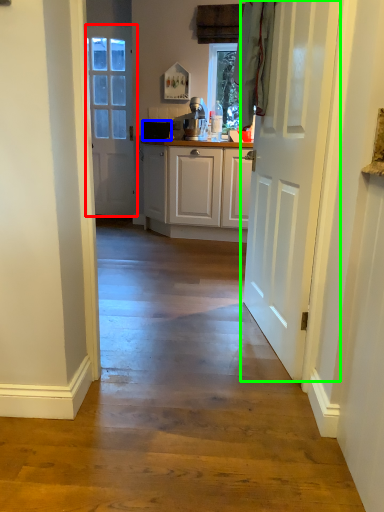
Question: Considering the real-world distances, which object is closest to door (highlighted by a red box)? appliance (highlighted by a blue box) or door (highlighted by a green box).

Choices:
 (A) appliance
 (B) door

Answer: (A)